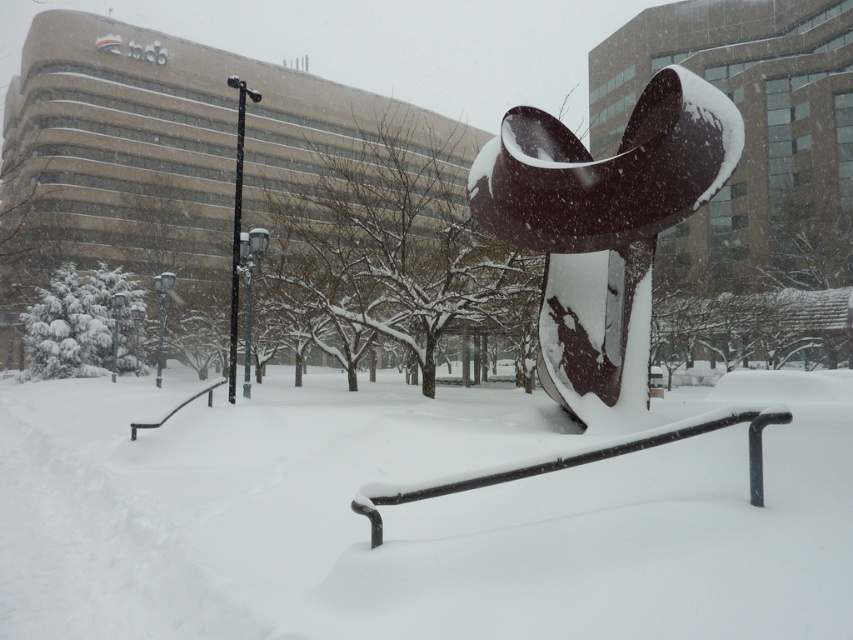
Is white matte snow at center further to the viewer compared to black polished metal abstract sculpture at center?

No.

Can you confirm if white matte snow at center is positioned to the right of black polished metal abstract sculpture at center?

Incorrect, white matte snow at center is not on the right side of black polished metal abstract sculpture at center.

Where is `white matte snow at center`? white matte snow at center is located at coordinates (413, 515).

The image size is (853, 640). In order to click on white matte snow at center in this screenshot , I will do `click(413, 515)`.

Between point (416, 417) and point (480, 486), which one is positioned in front?

Positioned in front is point (480, 486).

This screenshot has height=640, width=853. I want to click on white matte snow at center, so click(x=413, y=515).

Image resolution: width=853 pixels, height=640 pixels. Find the location of `white matte snow at center`. white matte snow at center is located at coordinates (x=413, y=515).

Is black polished metal abstract sculpture at center taller than black metal rail at lower center?

Correct, black polished metal abstract sculpture at center is much taller as black metal rail at lower center.

Is black polished metal abstract sculpture at center smaller than black metal rail at lower center?

Actually, black polished metal abstract sculpture at center might be larger than black metal rail at lower center.

Who is more distant from viewer, (x=717, y=163) or (x=415, y=492)?

Positioned behind is point (x=717, y=163).

You are a GUI agent. You are given a task and a screenshot of the screen. Output one action in this format:
    pyautogui.click(x=<x>, y=<y>)
    Task: Click on the black polished metal abstract sculpture at center
    Image resolution: width=853 pixels, height=640 pixels.
    Given the screenshot: What is the action you would take?
    pyautogui.click(x=602, y=227)